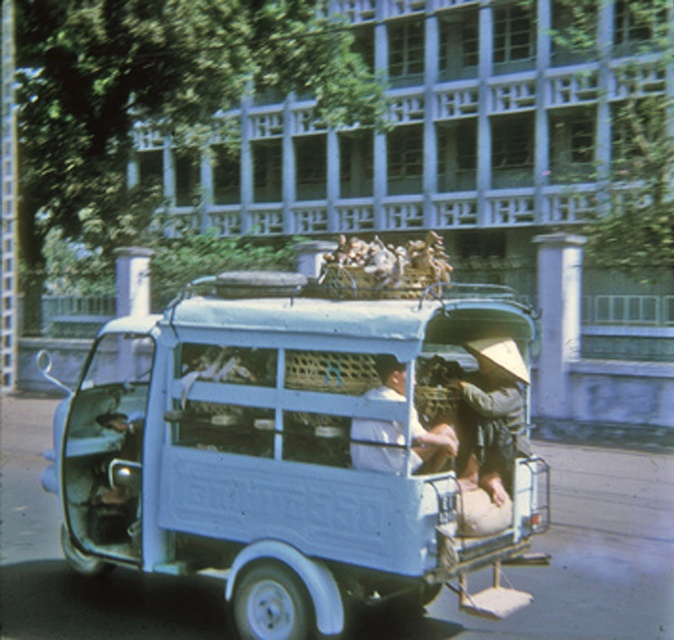
Which is in front, point (73, 419) or point (398, 440)?

Positioned in front is point (398, 440).

Is point (297, 440) behind point (359, 452)?

Yes.

Describe the element at coordinates (290, 451) in the screenshot. I see `light blue matte van at center` at that location.

You are a GUI agent. You are given a task and a screenshot of the screen. Output one action in this format:
    pyautogui.click(x=<x>, y=<y>)
    Task: Click on the light blue matte van at center
    
    Given the screenshot: What is the action you would take?
    pyautogui.click(x=290, y=451)